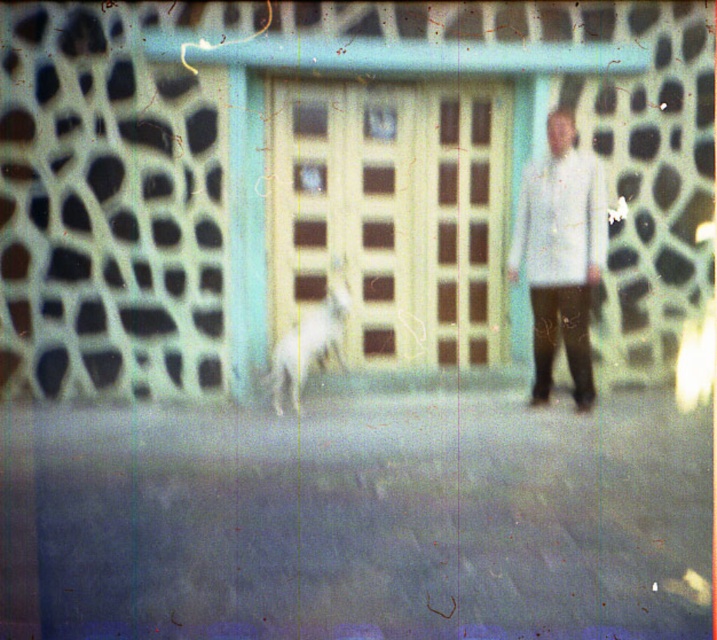
Locate an element on the screen. yellow matte door at center is located at coordinates (391, 214).

Does yellow matte door at center have a smaller size compared to white matte shirt at center?

Incorrect, yellow matte door at center is not smaller in size than white matte shirt at center.

Between point (402, 278) and point (554, 218), which one is positioned in front?

Positioned in front is point (554, 218).

Where is `yellow matte door at center`? The height and width of the screenshot is (640, 717). yellow matte door at center is located at coordinates (391, 214).

Between point (546, 216) and point (320, 362), which one is positioned in front?

Point (546, 216) is more forward.

Where is `white matte shirt at center`? The height and width of the screenshot is (640, 717). white matte shirt at center is located at coordinates (560, 256).

Identify the location of white matte shirt at center. (560, 256).

Which is above, yellow matte door at center or white fur dog at center?

yellow matte door at center is above.

The image size is (717, 640). In order to click on yellow matte door at center in this screenshot , I will do `click(391, 214)`.

The width and height of the screenshot is (717, 640). Find the location of `yellow matte door at center`. yellow matte door at center is located at coordinates (391, 214).